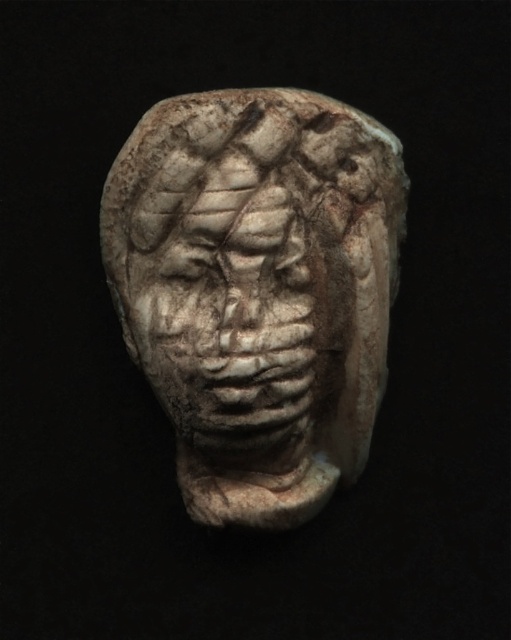
Question: Which of the following is the farthest from the observer?

Choices:
 (A) (284, 202)
 (B) (257, 177)

Answer: (A)

Question: Is white stone head at center above gray stone face at center?

Choices:
 (A) yes
 (B) no

Answer: (B)

Question: Does white stone head at center have a greater width compared to gray stone face at center?

Choices:
 (A) no
 (B) yes

Answer: (B)

Question: Can you confirm if white stone head at center is wider than gray stone face at center?

Choices:
 (A) yes
 (B) no

Answer: (A)